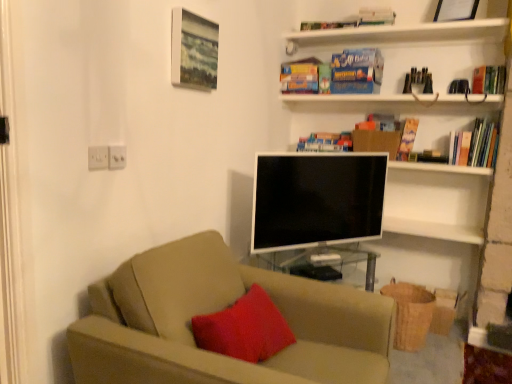
Question: Can you confirm if blue cardboard paperback book at upper center, which is the 2th paperback book from left to right, is wider than wooden textured picture frame at upper center, the second picture frame positioned from the top?

Choices:
 (A) yes
 (B) no

Answer: (A)

Question: Is blue cardboard paperback book at upper center, which is the 2th paperback book from left to right, next to wooden textured picture frame at upper center, positioned as the 1th picture frame in left-to-right order?

Choices:
 (A) no
 (B) yes

Answer: (A)

Question: Is blue cardboard paperback book at upper center, the second paperback book when ordered from right to left, facing away from wooden textured picture frame at upper center, marked as the 1th picture frame in a bottom-to-top arrangement?

Choices:
 (A) yes
 (B) no

Answer: (B)

Question: Is blue cardboard paperback book at upper center, which is the 2th paperback book from left to right, facing towards wooden textured picture frame at upper center, positioned as the 1th picture frame in left-to-right order?

Choices:
 (A) yes
 (B) no

Answer: (A)

Question: From a real-world perspective, is blue cardboard paperback book at upper center, the second paperback book when ordered from right to left, under wooden textured picture frame at upper center, acting as the second picture frame starting from the back?

Choices:
 (A) no
 (B) yes

Answer: (A)

Question: Could wooden textured picture frame at upper center, acting as the second picture frame starting from the back, be considered to be inside blue cardboard paperback book at upper center, the second paperback book when ordered from right to left?

Choices:
 (A) no
 (B) yes

Answer: (A)

Question: Is velvety red pillow at center at the back of hardcover book at upper right, the 2th book from the bottom?

Choices:
 (A) no
 (B) yes

Answer: (A)

Question: From a real-world perspective, is hardcover book at upper right, marked as the 3th book in a top-to-bottom arrangement, physically below velvety red pillow at center?

Choices:
 (A) no
 (B) yes

Answer: (A)

Question: Considering the relative positions of hardcover book at upper right, the 2th book from the bottom, and velvety red pillow at center in the image provided, is hardcover book at upper right, the 2th book from the bottom, to the right of velvety red pillow at center from the viewer's perspective?

Choices:
 (A) yes
 (B) no

Answer: (A)

Question: Is velvety red pillow at center a part of hardcover book at upper right, placed as the fourth book when sorted from left to right?

Choices:
 (A) yes
 (B) no

Answer: (B)

Question: Does hardcover book at upper right, marked as the 3th book in a top-to-bottom arrangement, have a larger size compared to velvety red pillow at center?

Choices:
 (A) yes
 (B) no

Answer: (B)

Question: Could you tell me if hardcover book at upper right, marked as the 3th book in a top-to-bottom arrangement, is turned towards velvety red pillow at center?

Choices:
 (A) yes
 (B) no

Answer: (B)

Question: Can we say hardcover book at upper right, placed as the fourth book when sorted from left to right, lies outside blue matte bookshelf at upper center, the first book from the left?

Choices:
 (A) yes
 (B) no

Answer: (A)